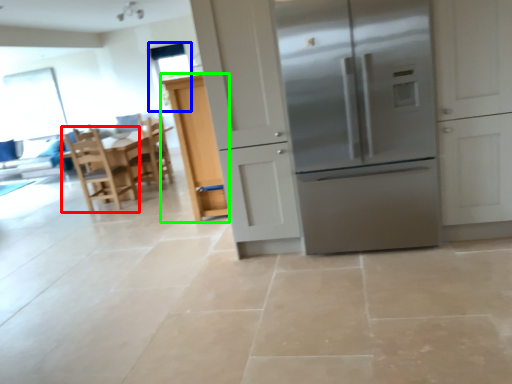
Question: Which object is the farthest from chair (highlighted by a red box)? Choose among these: window screen (highlighted by a blue box) or cabinetry (highlighted by a green box).

Choices:
 (A) window screen
 (B) cabinetry

Answer: (A)